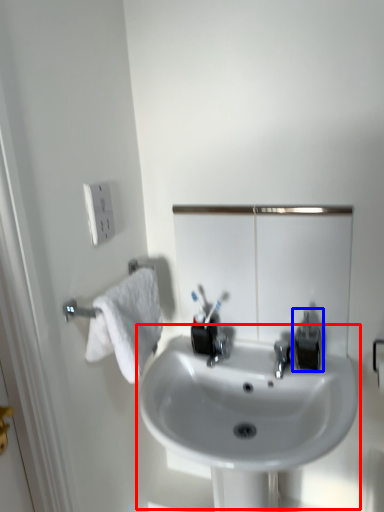
Question: Which point is closer to the camera, sink (highlighted by a red box) or plumbing fixture (highlighted by a blue box)?

Choices:
 (A) sink
 (B) plumbing fixture

Answer: (A)